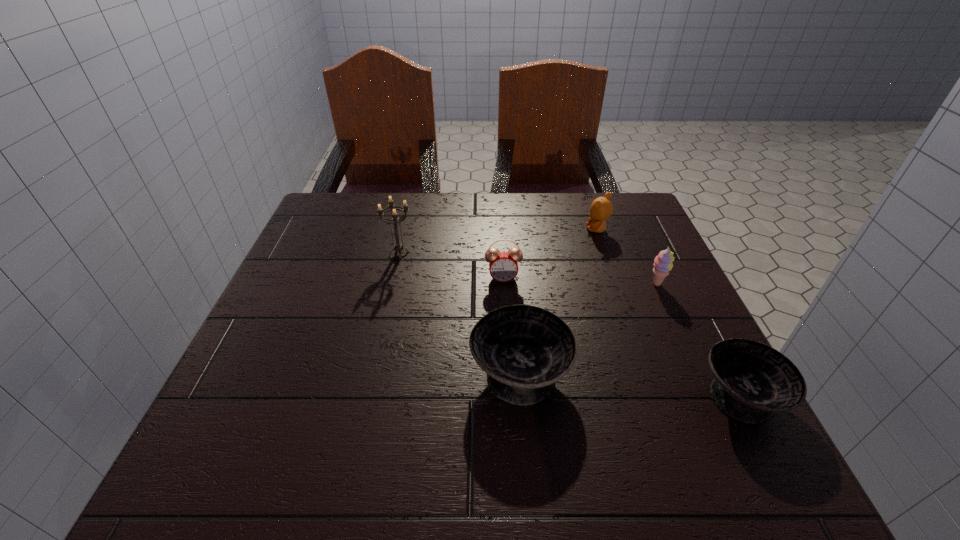
Identify the location of the taller bowl. (524, 349).

In order to click on the shorter bowl in this screenshot , I will do `click(752, 380)`.

The height and width of the screenshot is (540, 960). What are the coordinates of `the shortest object` in the screenshot? It's located at (752, 380).

Where is `the fourth object from left to right`? Image resolution: width=960 pixels, height=540 pixels. the fourth object from left to right is located at coordinates (601, 208).

Where is `teddy bear`? This screenshot has height=540, width=960. teddy bear is located at coordinates (601, 208).

You are a GUI agent. You are given a task and a screenshot of the screen. Output one action in this format:
    pyautogui.click(x=<x>, y=<y>)
    Task: Click on the alarm clock
    The image size is (960, 540).
    Given the screenshot: What is the action you would take?
    pyautogui.click(x=503, y=266)

You are a GUI agent. You are given a task and a screenshot of the screen. Output one action in this format:
    pyautogui.click(x=<x>, y=<y>)
    Task: Click on the sherbert
    
    Given the screenshot: What is the action you would take?
    pyautogui.click(x=663, y=264)

You are a GUI agent. You are given a task and a screenshot of the screen. Output one action in this format:
    pyautogui.click(x=<x>, y=<y>)
    Task: Click on the candle holder
    This screenshot has height=540, width=960.
    Given the screenshot: What is the action you would take?
    pyautogui.click(x=398, y=247)

Identify the location of the tallest object. (398, 247).

What are the coordinates of `free point located on the left of the left bowl` in the screenshot? It's located at (308, 372).